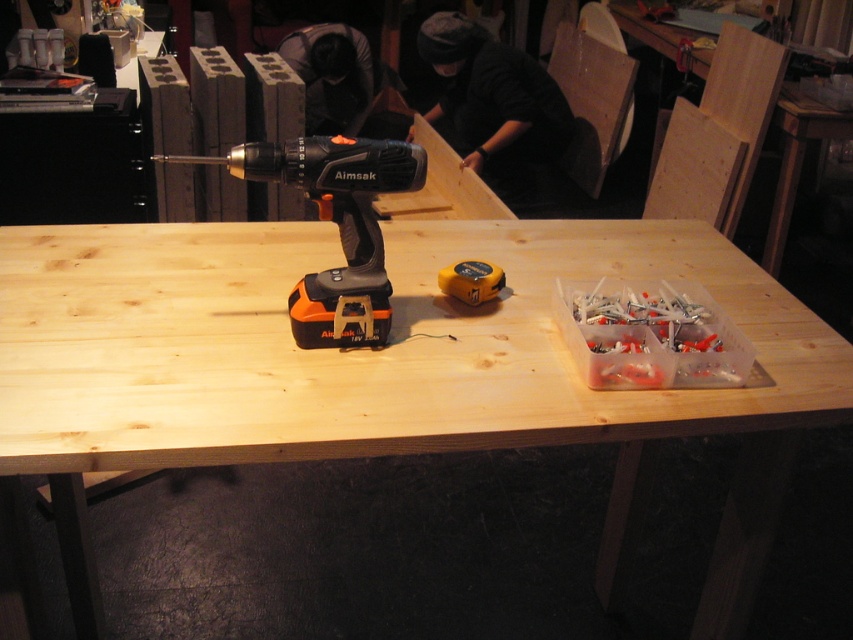
Can you confirm if black plastic drill at center is thinner than yellow rubber tape measure at center?

No.

What do you see at coordinates (337, 225) in the screenshot? I see `black plastic drill at center` at bounding box center [337, 225].

Who is more forward, (270,173) or (445,272)?

Point (270,173) is in front.

The height and width of the screenshot is (640, 853). Find the location of `black plastic drill at center`. black plastic drill at center is located at coordinates (337, 225).

Can you confirm if black fabric at upper center is bigger than black fabric person at upper center?

Yes, black fabric at upper center is bigger than black fabric person at upper center.

Which is behind, point (509, 74) or point (316, 92)?

The point (316, 92) is more distant.

Where is `black fabric at upper center`? black fabric at upper center is located at coordinates (492, 99).

Is point (347, 38) less distant than point (450, 280)?

No.

I want to click on black fabric person at upper center, so click(x=331, y=76).